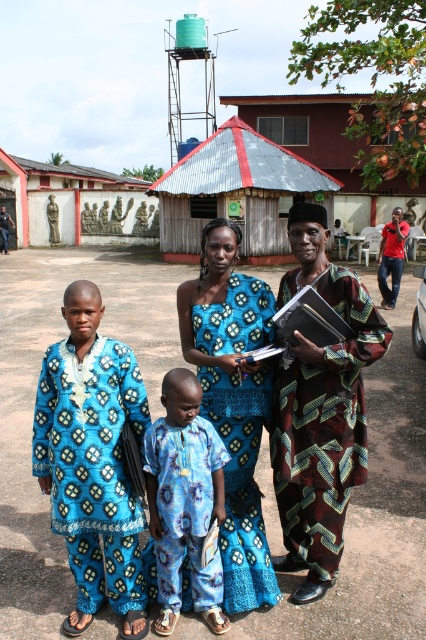
Can you confirm if blue printed fabric family at center is positioned below green plastic water tower at upper center?

Yes.

Is point (204, 342) positioned after point (176, 33)?

No, it is in front of (176, 33).

The height and width of the screenshot is (640, 426). I want to click on blue printed fabric family at center, so click(x=284, y=394).

Does blue printed fabric family at center lie in front of blue printed fabric shirt at center?

That is False.

Which is more to the left, blue printed fabric family at center or blue printed fabric shirt at center?

Positioned to the left is blue printed fabric shirt at center.

Which is in front, point (267, 288) or point (178, 534)?

Point (178, 534)

You are a GUI agent. You are given a task and a screenshot of the screen. Output one action in this format:
    pyautogui.click(x=<x>, y=<y>)
    Task: Click on the blue printed fabric family at center
    
    Given the screenshot: What is the action you would take?
    pyautogui.click(x=284, y=394)

Is the position of brown textured cloth at right less distant than that of blue printed dress at center?

That is True.

Between point (284, 374) and point (233, 244), which one is positioned behind?

The point (233, 244) is more distant.

Where is `brown textured cloth at right`? brown textured cloth at right is located at coordinates (319, 410).